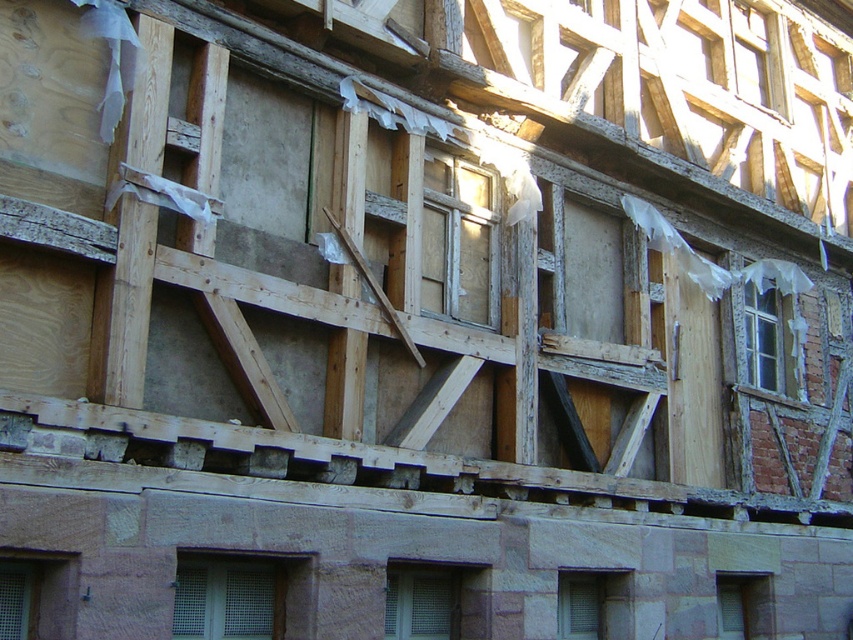
Question: Which point is farther to the camera?

Choices:
 (A) (459, 177)
 (B) (399, 600)

Answer: (A)

Question: Which point is closer to the camera taking this photo?

Choices:
 (A) (201, 637)
 (B) (798, 288)
 (C) (735, 621)
 (D) (570, 609)

Answer: (A)

Question: Is metallic mesh window at lower center wider than matte stone window at lower right?

Choices:
 (A) no
 (B) yes

Answer: (B)

Question: Which object appears farthest from the camera in this image?

Choices:
 (A) matte stone window at lower right
 (B) metallic mesh window at lower center
 (C) matte gray wooden window at center
 (D) transparent glass window at center

Answer: (A)

Question: Does transparent glass window at center come in front of transparent plastic window at center right?

Choices:
 (A) no
 (B) yes

Answer: (B)

Question: Can you confirm if matte gray glass window at lower center is thinner than matte gray wooden window at center?

Choices:
 (A) yes
 (B) no

Answer: (B)